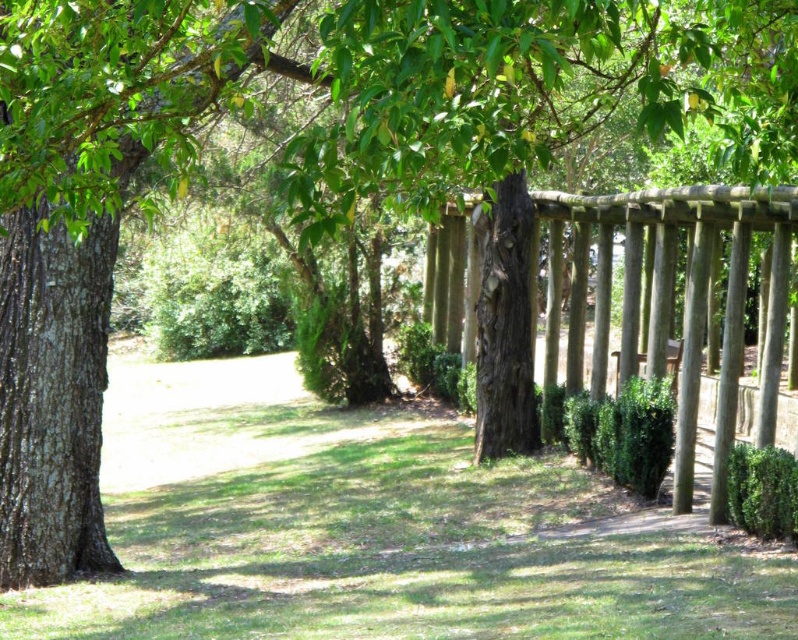
Is the position of green leafy hedge at center less distant than that of green leafy hedge at lower right?

No, green leafy hedge at center is further to the viewer.

Does green leafy hedge at center appear on the left side of green leafy hedge at lower right?

Yes, green leafy hedge at center is to the left of green leafy hedge at lower right.

The width and height of the screenshot is (798, 640). Describe the element at coordinates (617, 432) in the screenshot. I see `green leafy hedge at center` at that location.

At what (x,y) coordinates should I click in order to perform the action: click on green leafy hedge at center. Please return your answer as a coordinate pair (x, y). The image size is (798, 640). Looking at the image, I should click on (617, 432).

Does green leafy hedge at lower right have a greater width compared to wooden bench at center?

No.

Can you confirm if green leafy hedge at lower right is positioned to the right of wooden bench at center?

No, green leafy hedge at lower right is not to the right of wooden bench at center.

Is point (771, 477) farther from viewer compared to point (682, 340)?

No, it is in front of (682, 340).

The height and width of the screenshot is (640, 798). In order to click on green leafy hedge at lower right in this screenshot , I will do `click(761, 492)`.

Who is lower down, green grass at center or green leafy hedge at lower right?

Positioned lower is green grass at center.

Can you confirm if green grass at center is taller than green leafy hedge at lower right?

Yes, green grass at center is taller than green leafy hedge at lower right.

Does point (662, 628) come behind point (775, 465)?

No, (662, 628) is in front of (775, 465).

Locate an element on the screen. Image resolution: width=798 pixels, height=640 pixels. green grass at center is located at coordinates (378, 529).